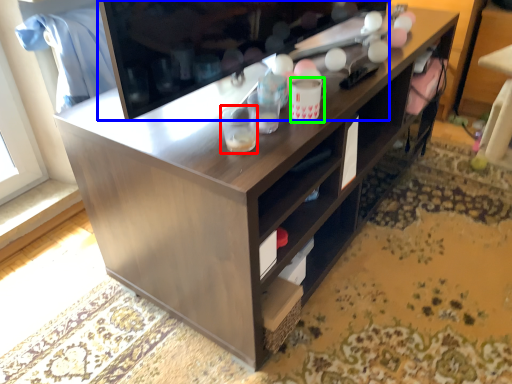
Question: Estimate the real-world distances between objects in this image. Which object is farther from beverage (highlighted by a red box), television (highlighted by a blue box) or beverage (highlighted by a green box)?

Choices:
 (A) television
 (B) beverage

Answer: (A)